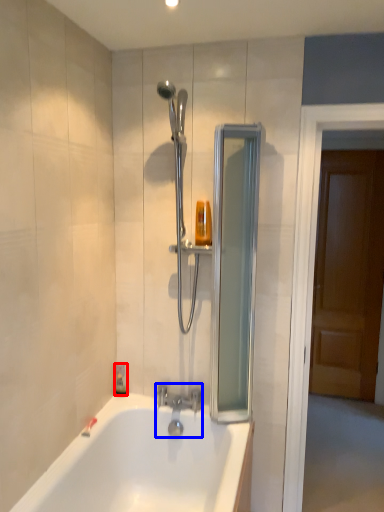
Question: Which of the following is the closest to the observer, soap dispenser (highlighted by a red box) or tap (highlighted by a blue box)?

Choices:
 (A) soap dispenser
 (B) tap

Answer: (B)